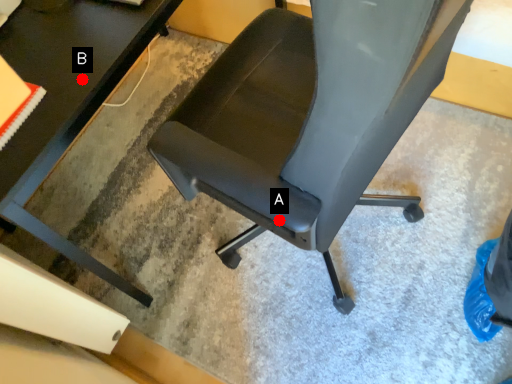
Question: Two points are circled on the image, labeled by A and B beside each circle. Among these points, which one is nearest to the camera?

Choices:
 (A) A is closer
 (B) B is closer

Answer: (A)